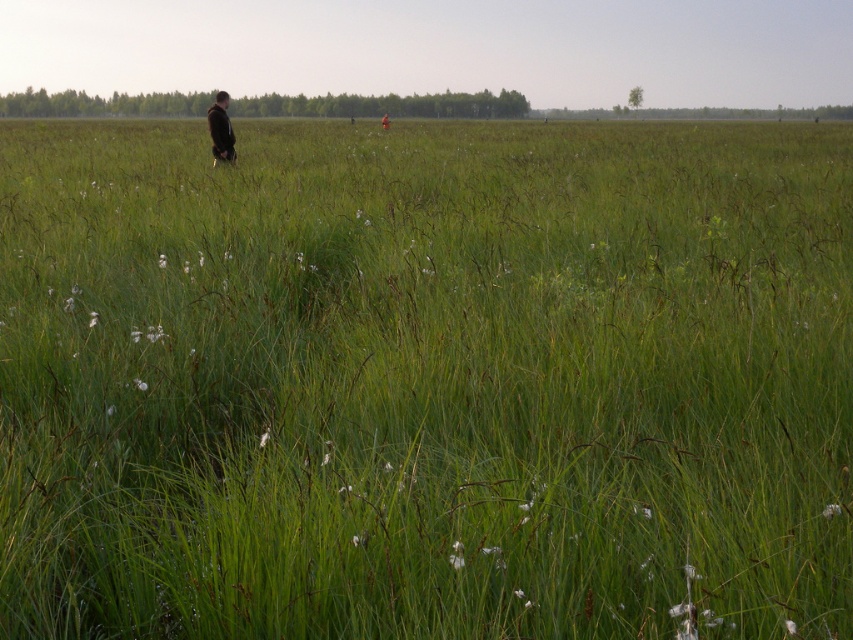
You are a photographer planning to take a group photo of the black matte jacket at center and dark brown leather jacket at center in the grassland. The camera you are using has a maximum focus range of 20 meters. Can you capture both subjects clearly in a single shot?

The black matte jacket at center and dark brown leather jacket at center are 22.18 meters apart, which exceeds the camera maximum focus range of 20 meters. Therefore, it is not possible to capture both subjects clearly in a single shot.

You are navigating a vast grassland and need to locate the black matte jacket at center. Based on the coordinates provided in the Objects Description, can you determine its position relative to the edges of the grassland?

The black matte jacket at center is located at coordinates approximately 20.3 percent from the left edge and 25.9 percent from the bottom edge of the grassland image. This places it closer to the left side than the center horizontally and slightly above the midpoint vertically.

You are a hiker navigating the grassland and need to locate two jackets left behind. According to the image, which jacket is positioned lower down between the black matte jacket at center and the dark brown leather jacket at center?

The black matte jacket at center is located below the dark brown leather jacket at center, so it is positioned lower down.